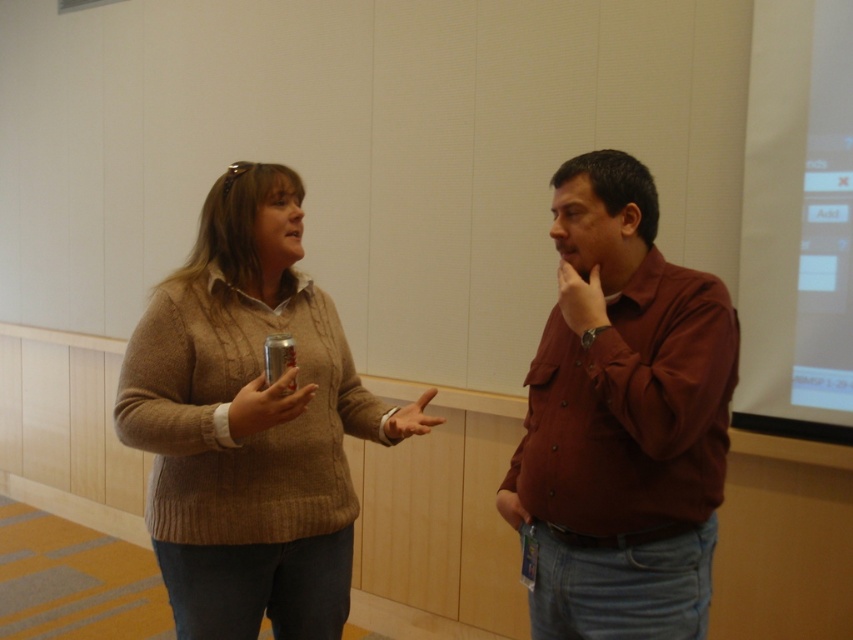
You are a photographer setting up for a portrait. You have to ensure that the matte brown shirt at center and the metallic can at center are both visible in the frame. Based on their positions, which object should you focus on first to ensure both are in focus?

The matte brown shirt at center is positioned under metallic can at center, so focusing on the matte brown shirt at center first will ensure both are in focus since it is closer to the camera.

What is the exact coordinate of the knitted sweater at center?

The knitted sweater at center is located at point (x=250, y=422).